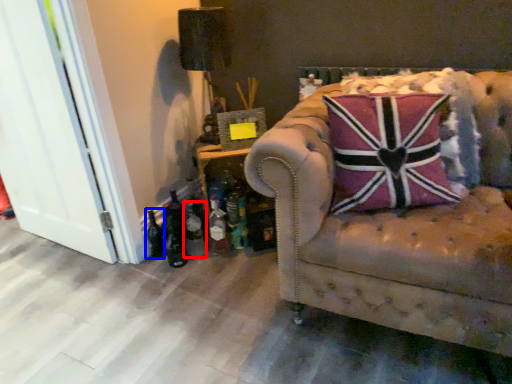
Question: Which of the following is the closest to the observer, bottle (highlighted by a red box) or bottle (highlighted by a blue box)?

Choices:
 (A) bottle
 (B) bottle

Answer: (A)